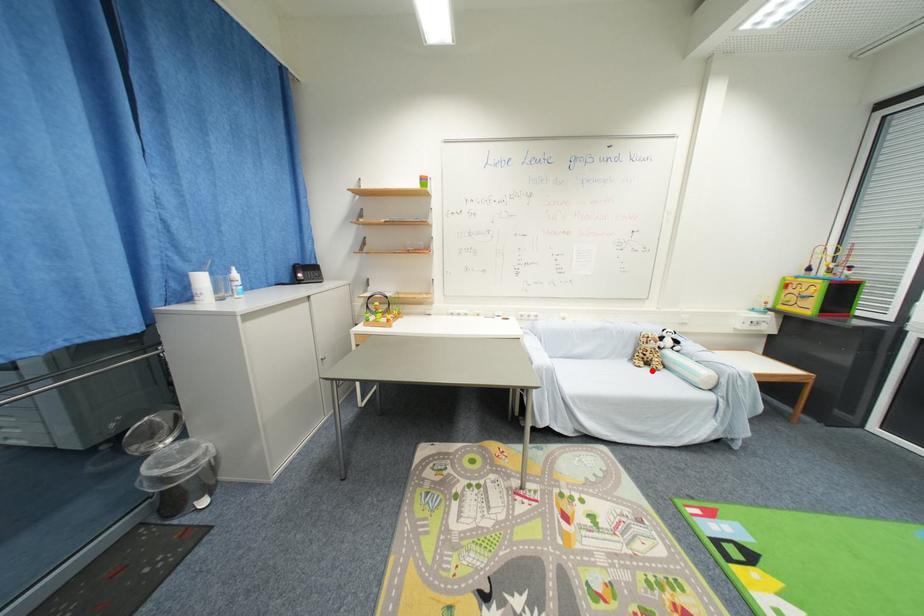
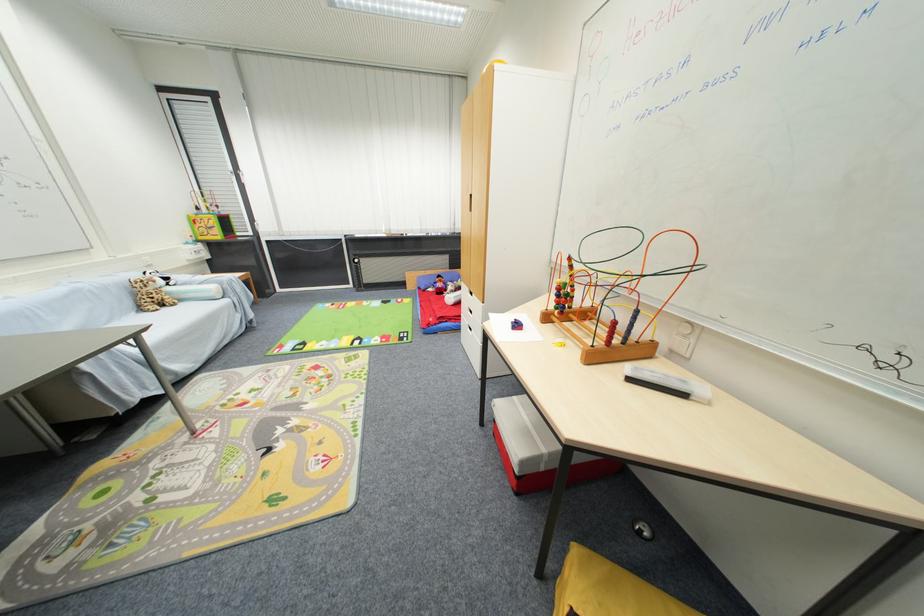
Find the pixel in the second image that matches the highlighted location in the first image.

(171, 310)